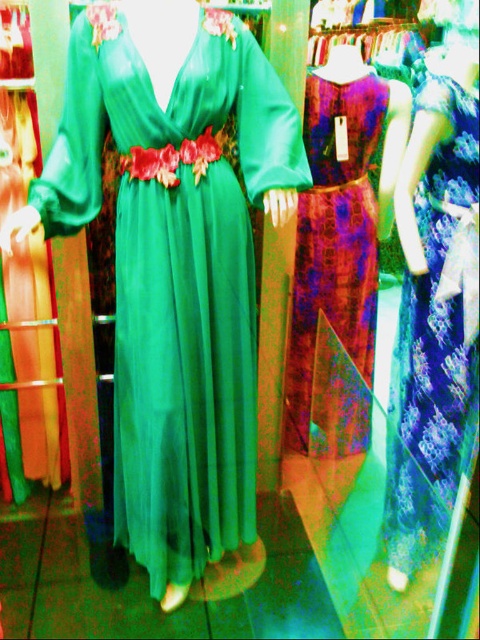
You are a customer in a clothing store and want to know if the green satin dress at center is higher than the blue floral dress at right. Can you determine this based on their positions?

The green satin dress at center is above the blue floral dress at right, so yes, it is higher.

You are a customer in a clothing store and see the blue floral dress at right and the patterned silk dress at center. Which dress is taller?

The blue floral dress at right is taller than the patterned silk dress at center.